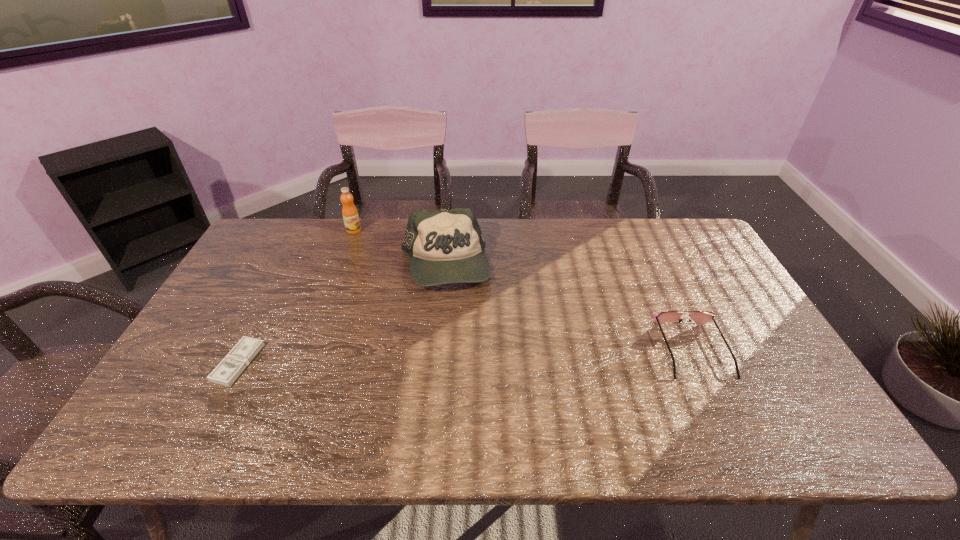
You are a GUI agent. You are given a task and a screenshot of the screen. Output one action in this format:
    pyautogui.click(x=<x>, y=<y>)
    Task: Click on the vacant space at the near right corner of the desktop
    This screenshot has width=960, height=540.
    Given the screenshot: What is the action you would take?
    pyautogui.click(x=774, y=402)

At what (x,y) coordinates should I click in order to perform the action: click on free spot between the rightmost object and the leftmost object. Please return your answer as a coordinate pair (x, y). This screenshot has height=540, width=960. Looking at the image, I should click on (466, 356).

At what (x,y) coordinates should I click in order to perform the action: click on vacant region between the third object from right to left and the baseball cap. Please return your answer as a coordinate pair (x, y). The height and width of the screenshot is (540, 960). Looking at the image, I should click on (399, 247).

Locate an element on the screen. This screenshot has width=960, height=540. free space between the orange juice and the shortest object is located at coordinates (296, 296).

The height and width of the screenshot is (540, 960). What are the coordinates of `vacant point located between the rightmost object and the leftmost object` in the screenshot? It's located at (466, 356).

You are a GUI agent. You are given a task and a screenshot of the screen. Output one action in this format:
    pyautogui.click(x=<x>, y=<y>)
    Task: Click on the free space between the sunglasses and the shortest object
    The image size is (960, 540).
    Given the screenshot: What is the action you would take?
    pyautogui.click(x=466, y=356)

Identify the location of vacant area that lies between the third object from right to left and the second shortest object. The height and width of the screenshot is (540, 960). (523, 290).

The width and height of the screenshot is (960, 540). I want to click on free space between the leftmost object and the rightmost object, so click(x=466, y=356).

Image resolution: width=960 pixels, height=540 pixels. What are the coordinates of `empty space that is in between the leftmost object and the third object from left to right` in the screenshot? It's located at (342, 314).

You are a GUI agent. You are given a task and a screenshot of the screen. Output one action in this format:
    pyautogui.click(x=<x>, y=<y>)
    Task: Click on the vacant region between the third shortest object and the money
    The image size is (960, 540).
    Given the screenshot: What is the action you would take?
    pyautogui.click(x=342, y=314)